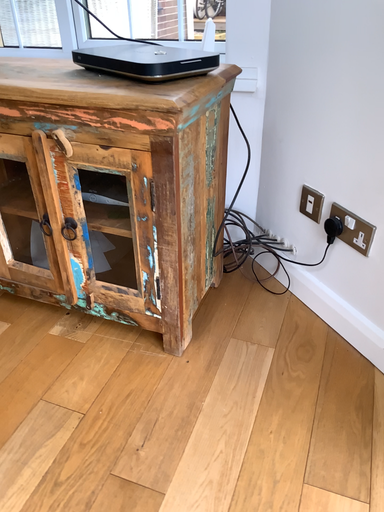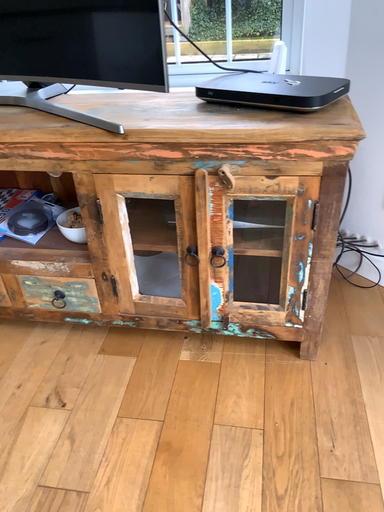
Question: Which way did the camera rotate in the video?

Choices:
 (A) rotated right
 (B) rotated left

Answer: (A)